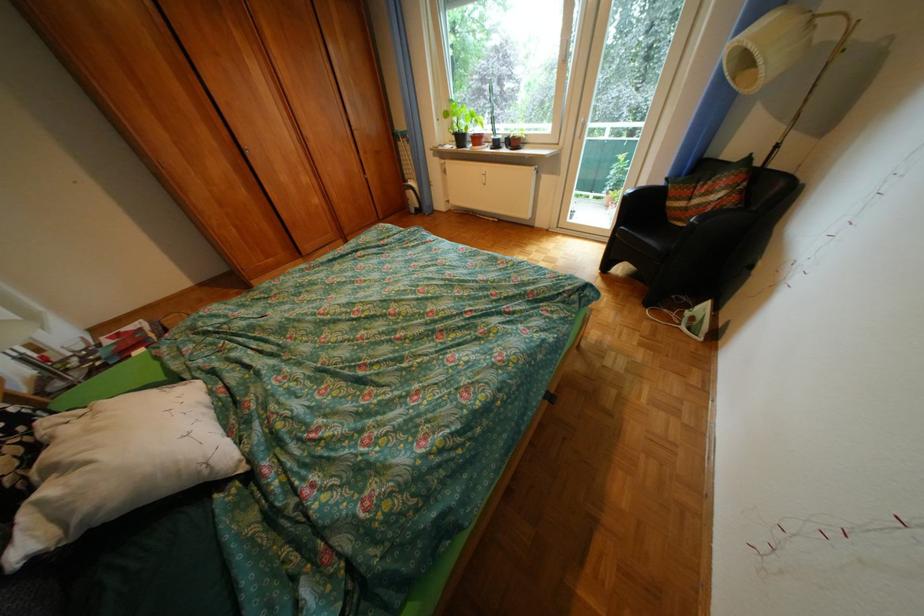
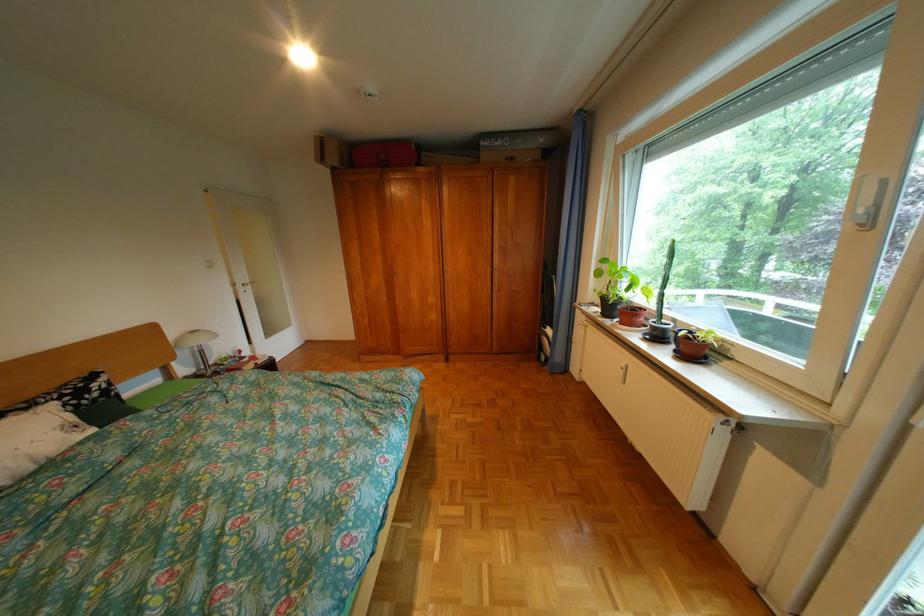
In the second image, find the point that corresponds to the point at 234,167 in the first image.

(392, 280)